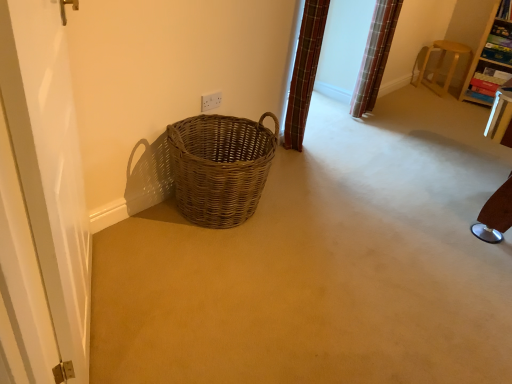
You are a GUI agent. You are given a task and a screenshot of the screen. Output one action in this format:
    pyautogui.click(x=<x>, y=<y>)
    Task: Click on the vacant space that is in between light brown wooden stool at upper right, which is the 1th furniture in left-to-right order, and woven brown basket at center
    
    Given the screenshot: What is the action you would take?
    pyautogui.click(x=364, y=130)